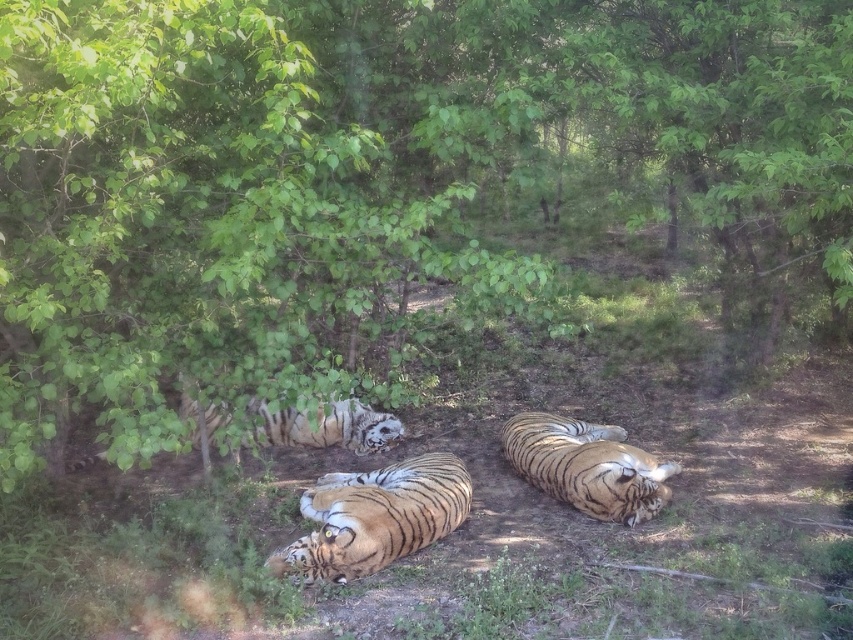
Question: Can you confirm if orange striped tiger at center is positioned below white fur tiger at center?

Choices:
 (A) no
 (B) yes

Answer: (B)

Question: Which object is positioned farthest from the orange striped tiger at center?

Choices:
 (A) orange striped tiger at lower right
 (B) white fur tiger at center

Answer: (B)

Question: Based on their relative distances, which object is farther from the orange striped tiger at center?

Choices:
 (A) orange striped tiger at lower right
 (B) white fur tiger at center

Answer: (B)

Question: Where is orange striped tiger at center located in relation to white fur tiger at center in the image?

Choices:
 (A) left
 (B) right

Answer: (B)

Question: Which object is positioned farthest from the orange striped tiger at center?

Choices:
 (A) white fur tiger at center
 (B) orange striped tiger at lower right

Answer: (A)

Question: Is orange striped tiger at center to the left of orange striped tiger at lower right from the viewer's perspective?

Choices:
 (A) yes
 (B) no

Answer: (A)